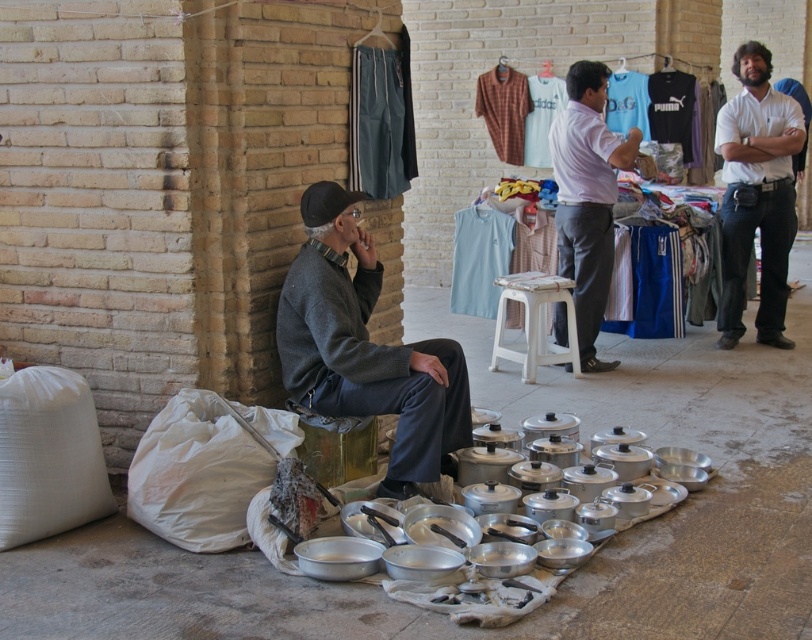
You are a tailor observing two garments in the center of the image, the dark gray sweater at center and the light purple shirt at center. Which garment takes up more space visually?

The light purple shirt at center occupies more space than the dark gray sweater at center according to the description.

You are a tailor observing a man in an open market. You need to determine which clothing item, the dark gray sweater at center or the white cotton shirt at upper right, is shorter in length. Based on the scene description, which one is shorter?

The dark gray sweater at center is shorter than the white cotton shirt at upper right according to the description.